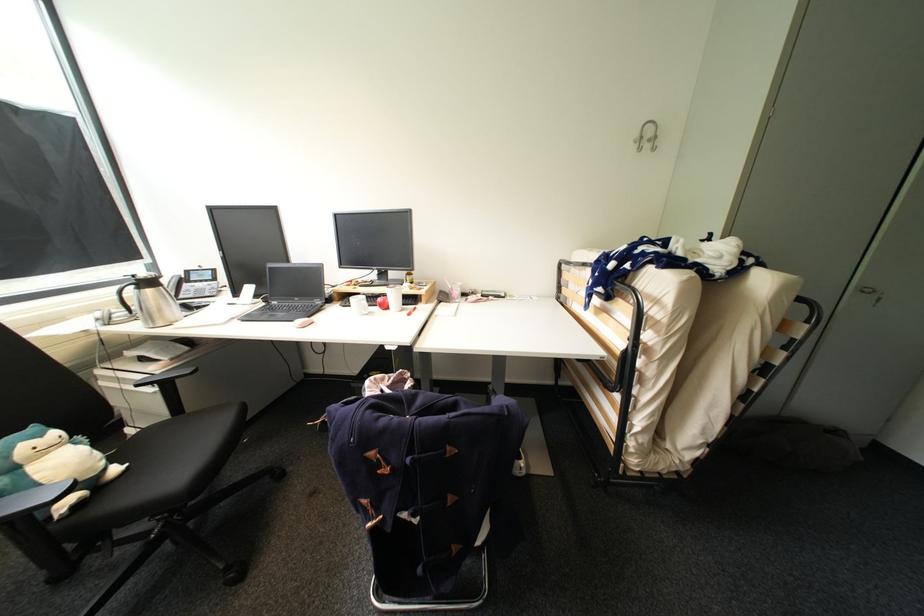
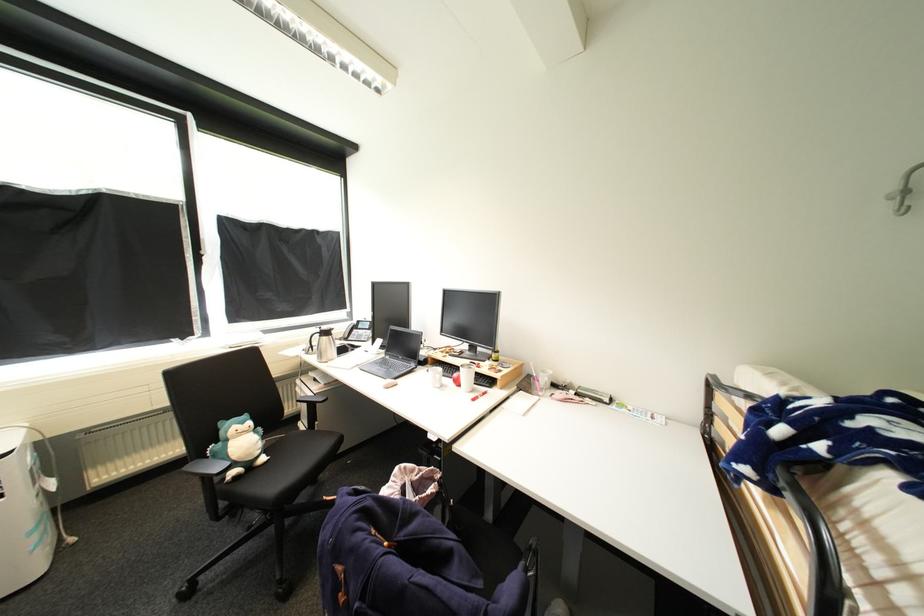
In the second image, find the point that corresponds to the point at 641,143 in the first image.

(900, 199)